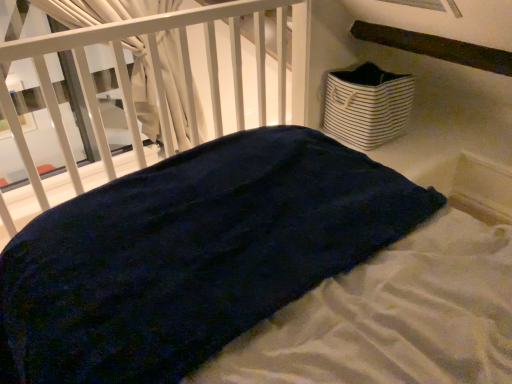
Question: From their relative heights in the image, would you say white striped fabric basket at upper right is taller or shorter than dark blue plush at center?

Choices:
 (A) short
 (B) tall

Answer: (A)

Question: Is point (327, 102) closer or farther from the camera than point (271, 0)?

Choices:
 (A) farther
 (B) closer

Answer: (A)

Question: From the image's perspective, relative to dark blue plush at center, is white striped fabric basket at upper right above or below?

Choices:
 (A) below
 (B) above

Answer: (B)

Question: Looking at the image, does dark blue plush at center seem bigger or smaller compared to white striped fabric basket at upper right?

Choices:
 (A) small
 (B) big

Answer: (B)

Question: From the image's perspective, relative to white striped fabric basket at upper right, is dark blue plush at center above or below?

Choices:
 (A) below
 (B) above

Answer: (A)

Question: Would you say dark blue plush at center is inside or outside white striped fabric basket at upper right?

Choices:
 (A) outside
 (B) inside

Answer: (A)

Question: Based on their positions, is dark blue plush at center located to the left or right of white striped fabric basket at upper right?

Choices:
 (A) left
 (B) right

Answer: (A)